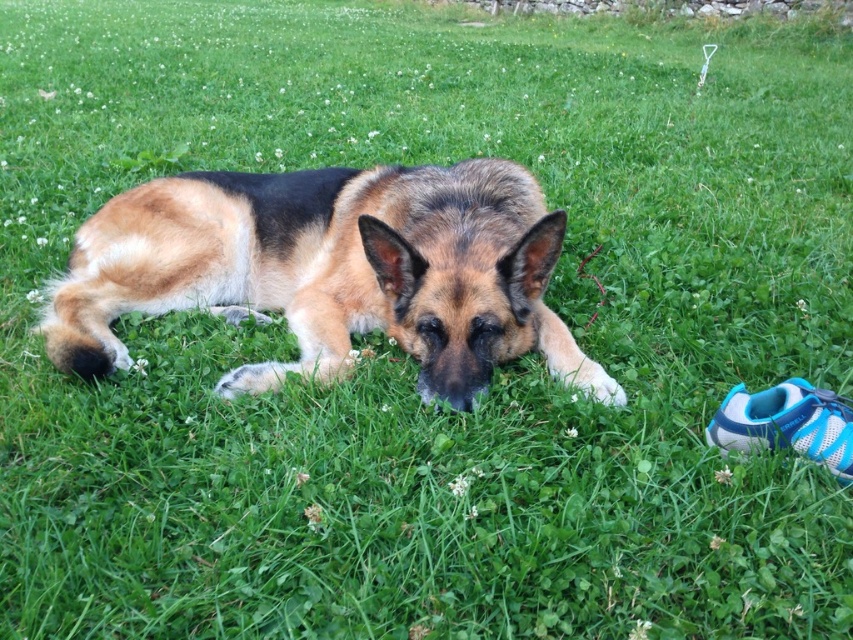
Which is below, brown and black fur dog at center or blue mesh shoe at lower right?

blue mesh shoe at lower right is below.

Is point (469, 259) closer to viewer compared to point (814, 406)?

No, it is behind (814, 406).

Between point (553, 248) and point (811, 449), which one is positioned behind?

The point (553, 248) is behind.

Where is `brown and black fur dog at center`? The height and width of the screenshot is (640, 853). brown and black fur dog at center is located at coordinates (331, 272).